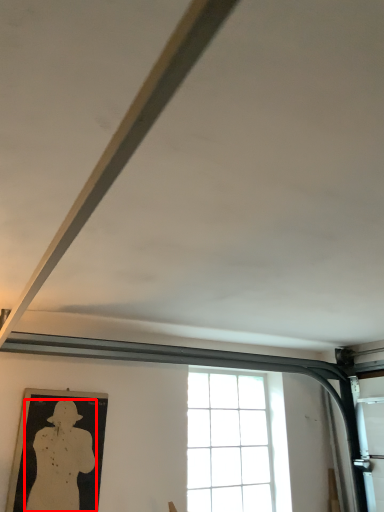
Question: Observing the image, what is the correct spatial positioning of person (annotated by the red box) in reference to window?

Choices:
 (A) right
 (B) left

Answer: (B)